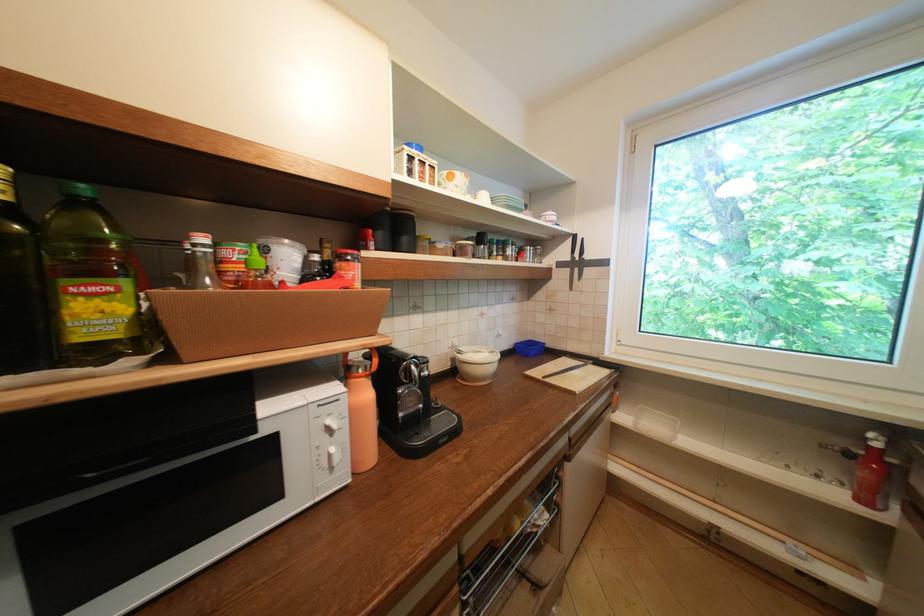
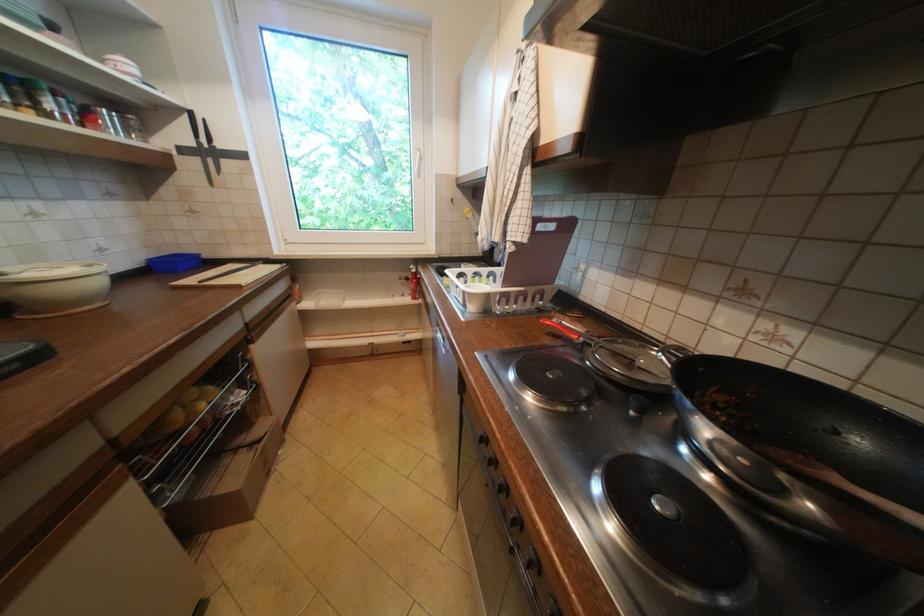
Where in the second image is the point corresponding to point (825, 477) from the first image?

(410, 296)